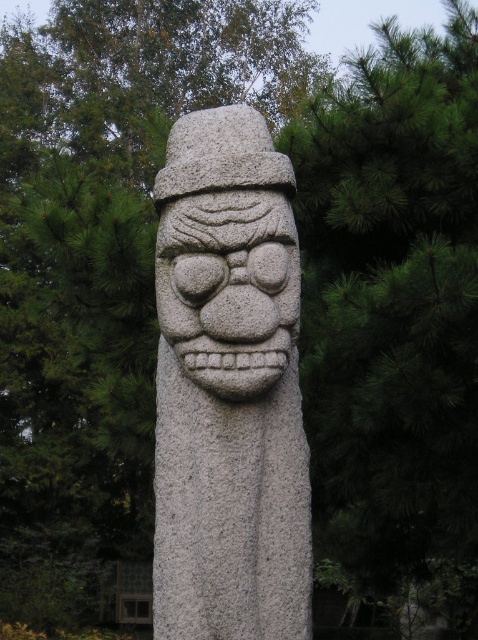
Question: Which of the following is the closest to the observer?

Choices:
 (A) (260, 280)
 (B) (238, 326)

Answer: (B)

Question: Among these points, which one is farthest from the camera?

Choices:
 (A) (223, 358)
 (B) (293, 308)

Answer: (B)

Question: Can you confirm if gray stone statue at center is thinner than granite stone face at center?

Choices:
 (A) no
 (B) yes

Answer: (A)

Question: Which point is farther to the camera?

Choices:
 (A) (213, 348)
 (B) (307, 572)

Answer: (B)

Question: Is gray stone statue at center to the left of granite stone face at center from the viewer's perspective?

Choices:
 (A) no
 (B) yes

Answer: (B)

Question: Is gray stone statue at center closer to the viewer compared to granite stone face at center?

Choices:
 (A) no
 (B) yes

Answer: (A)